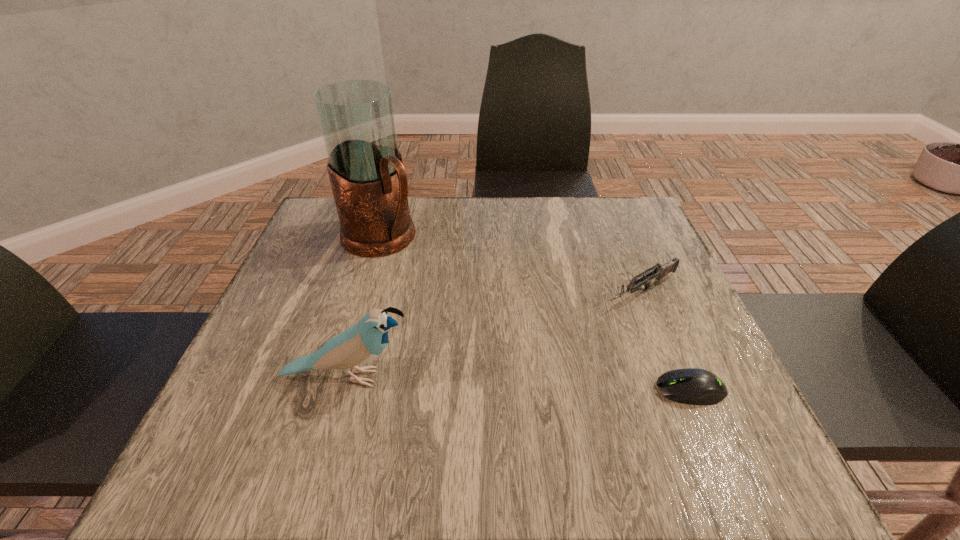
Find the location of a particular element. bird is located at coordinates (361, 343).

Where is `the shortest object`? the shortest object is located at coordinates (692, 386).

Where is `pitcher`? The width and height of the screenshot is (960, 540). pitcher is located at coordinates (369, 182).

This screenshot has width=960, height=540. In order to click on the tallest object in this screenshot , I will do `click(369, 182)`.

Where is `the second shortest object`? the second shortest object is located at coordinates (659, 272).

Find the location of a particular element. Image resolution: width=960 pixels, height=540 pixels. gun is located at coordinates (659, 272).

This screenshot has height=540, width=960. In order to click on vacant area situated 0.370m at the face of the second tallest object in this screenshot , I will do `click(617, 377)`.

Image resolution: width=960 pixels, height=540 pixels. I want to click on blank area located 0.060m on the wheel side of the shortest object, so click(x=622, y=390).

Identify the location of free space located 0.080m on the wheel side of the shortest object. The height and width of the screenshot is (540, 960). (611, 390).

Identify the location of vacant point located 0.160m on the wheel side of the shortest object. The width and height of the screenshot is (960, 540). (565, 390).